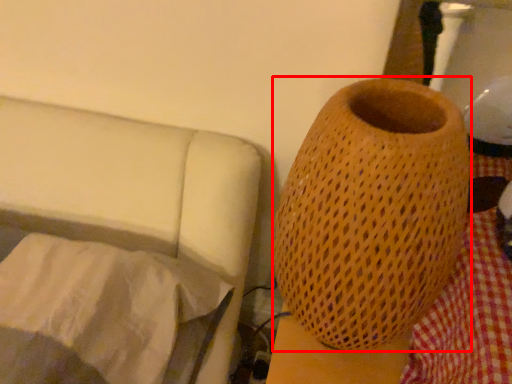
Question: From the image's perspective, where is vase (annotated by the red box) located in relation to sheet in the image?

Choices:
 (A) above
 (B) below

Answer: (A)